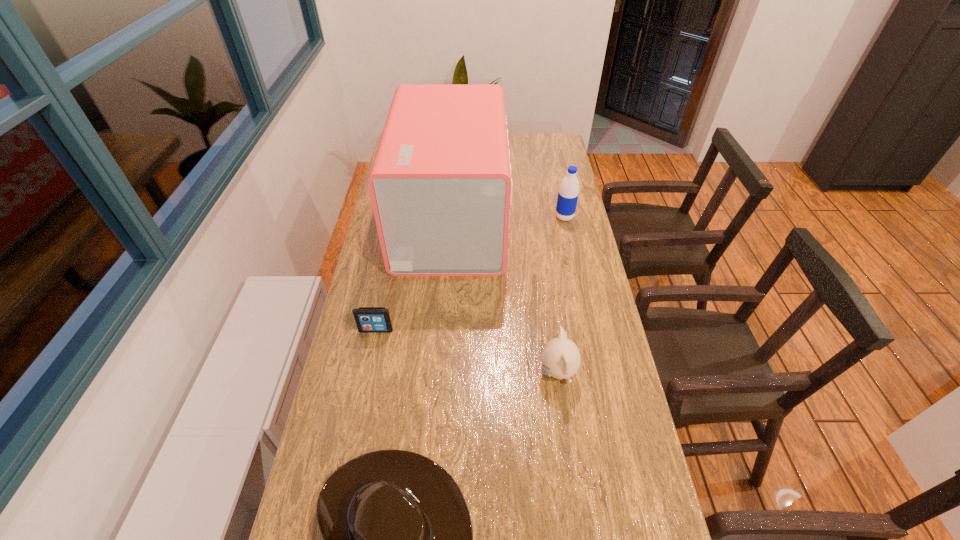
Identify the location of the tallest object. The image size is (960, 540). (440, 184).

This screenshot has width=960, height=540. In order to click on the second tallest object in this screenshot , I will do `click(568, 193)`.

This screenshot has width=960, height=540. In order to click on water bottle in this screenshot , I will do `click(568, 193)`.

Find the location of `kitten`. kitten is located at coordinates (560, 357).

The image size is (960, 540). Identify the location of the third shortest object. (560, 357).

Image resolution: width=960 pixels, height=540 pixels. Identify the location of the second shortest object. (368, 319).

The width and height of the screenshot is (960, 540). I want to click on the third farthest object, so coord(368,319).

What are the coordinates of `blank space located on the surface of the tallest object where the text is embossed` in the screenshot? It's located at 572,221.

At what (x,y) coordinates should I click in order to perform the action: click on free space located on the front of the rightmost object. Please return your answer as a coordinate pair (x, y). Image resolution: width=960 pixels, height=540 pixels. Looking at the image, I should click on (578, 281).

At what (x,y) coordinates should I click in order to perform the action: click on free space located on the face of the fourth object from left to right. Please return your answer as a coordinate pair (x, y). This screenshot has height=540, width=960. Looking at the image, I should click on (396, 373).